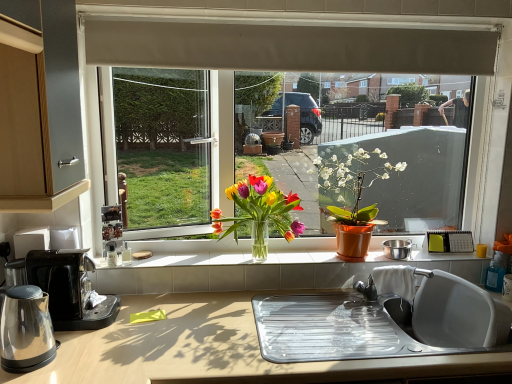
The height and width of the screenshot is (384, 512). I want to click on free spot above beige fabric exhaust hood at upper center (from a real-world perspective), so click(x=302, y=26).